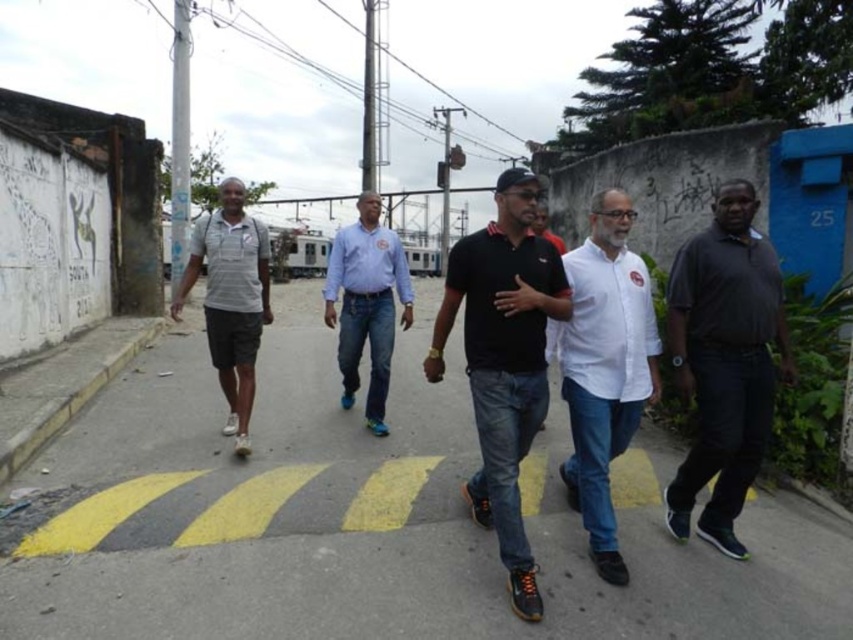
What do you see at coordinates (724, 362) in the screenshot? I see `dark gray shirt at right` at bounding box center [724, 362].

Who is higher up, dark gray shirt at right or black matte polo shirt at center?

dark gray shirt at right is above.

Does point (747, 216) come in front of point (486, 362)?

No, it is behind (486, 362).

Identify the location of dark gray shirt at right. (724, 362).

Can you confirm if yellow asphalt at center is bigger than white matte shirt at center?

Yes, yellow asphalt at center is bigger than white matte shirt at center.

Does point (722, 577) lie behind point (590, 490)?

No, it is not.

Image resolution: width=853 pixels, height=640 pixels. I want to click on yellow asphalt at center, so click(x=368, y=520).

I want to click on dark gray shirt at right, so click(724, 362).

Can you confirm if dark gray shirt at right is shorter than white matte shirt at center?

Incorrect, dark gray shirt at right's height does not fall short of white matte shirt at center's.

Is point (689, 305) more distant than point (611, 403)?

Yes.

Locate an element on the screen. The height and width of the screenshot is (640, 853). dark gray shirt at right is located at coordinates (724, 362).